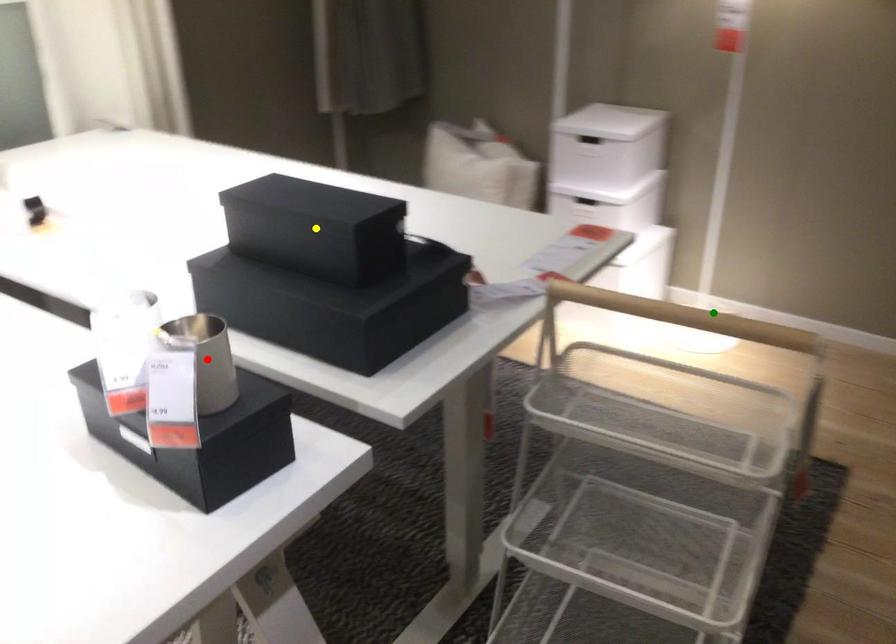
Order these from nearest to farthest:
- green point
- yellow point
- red point

red point
yellow point
green point